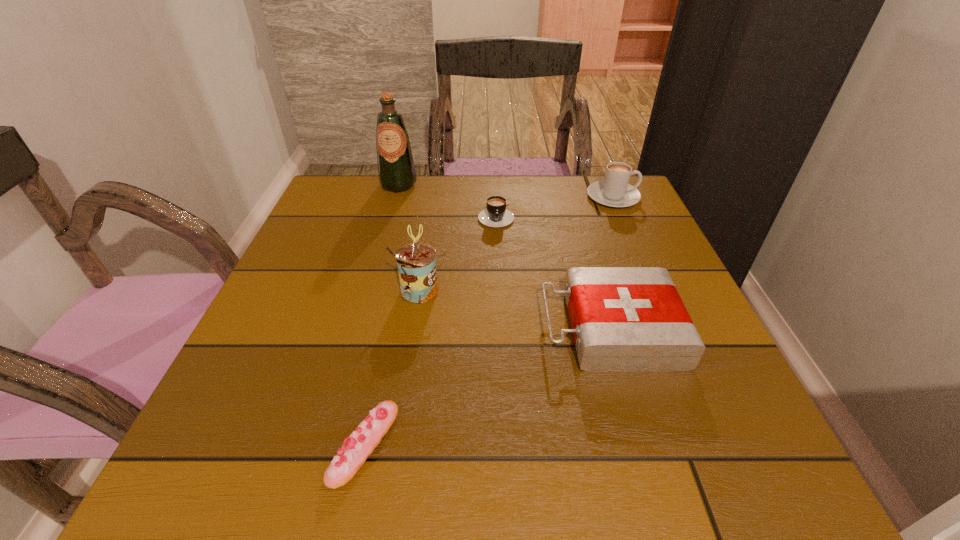
Where is `the first-aid kit positioned at the right edge`? the first-aid kit positioned at the right edge is located at coordinates (624, 319).

Identify the location of object that is positioned at the far left corner. (396, 171).

At what (x,y) coordinates should I click in order to perform the action: click on object that is at the far right corner. Please return your answer as a coordinate pair (x, y). The image size is (960, 540). Looking at the image, I should click on (614, 191).

In order to click on free space at the far edge in this screenshot , I will do `click(547, 211)`.

Where is `blank space at the near edge`? This screenshot has height=540, width=960. blank space at the near edge is located at coordinates (415, 456).

This screenshot has height=540, width=960. In order to click on vacant space at the left edge of the desktop in this screenshot , I will do `click(327, 328)`.

This screenshot has width=960, height=540. Find the location of `vacant space at the right edge of the desktop`. vacant space at the right edge of the desktop is located at coordinates (641, 264).

Where is `free space at the far left corner of the desktop`? This screenshot has width=960, height=540. free space at the far left corner of the desktop is located at coordinates (355, 224).

You are a GUI agent. You are given a task and a screenshot of the screen. Output one action in this format:
    pyautogui.click(x=<x>, y=<y>)
    Task: Click on the vacant space that's between the second shortest object and the first-aid kit
    
    Given the screenshot: What is the action you would take?
    pyautogui.click(x=553, y=272)

Image resolution: width=960 pixels, height=540 pixels. Identify the location of free area in between the olive oil and the right cappuccino. (506, 191).